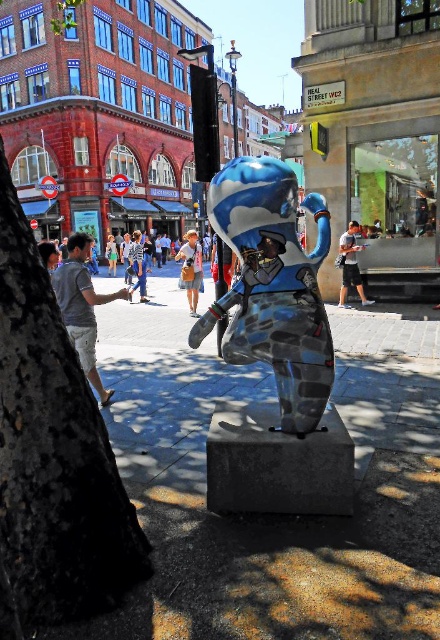
You are standing in front of the sculpture in the scene. There are two points marked on the sculpture. One is at coordinate point (62,320) and the other is at point (359,294). Which point is closer to you?

The point at coordinate (62,320) is closer to you than the point at (359,294).